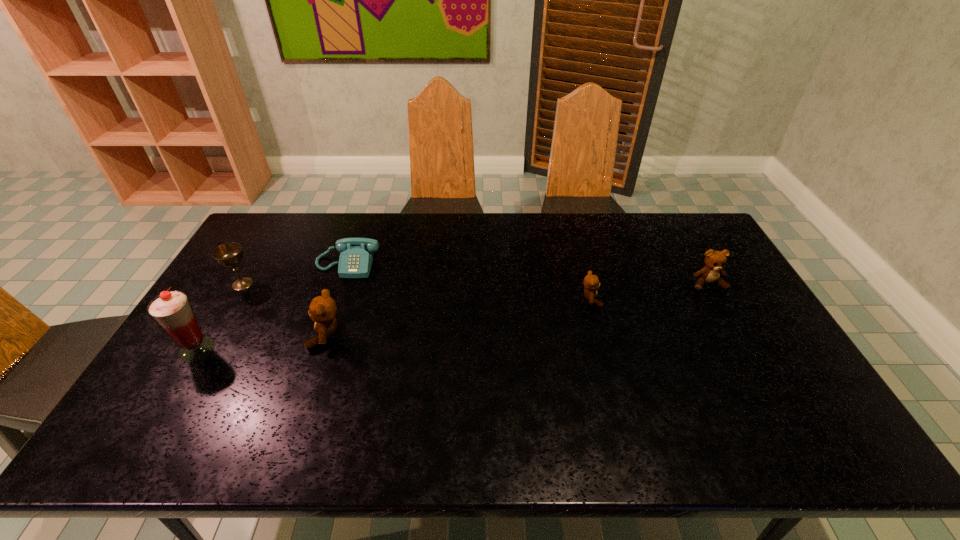
In order to click on object present at the right edge in this screenshot , I will do `click(715, 261)`.

Locate an element on the screen. This screenshot has width=960, height=540. vacant space at the far edge of the desktop is located at coordinates (587, 246).

Locate an element on the screen. This screenshot has width=960, height=540. vacant area at the left edge is located at coordinates (229, 309).

Where is `vacant position at the right edge of the desktop`? vacant position at the right edge of the desktop is located at coordinates (750, 321).

I want to click on free point at the far right corner, so click(x=670, y=244).

Where is `vacant space in between the nearest teddy bear and the tallest object`? vacant space in between the nearest teddy bear and the tallest object is located at coordinates (262, 342).

Find the location of a particular element. empty space that is in between the nearest teddy bear and the second object from right to left is located at coordinates (459, 317).

You are a GUI agent. You are given a task and a screenshot of the screen. Output one action in this format:
    pyautogui.click(x=<x>, y=<y>)
    Task: Click on the vacant space in between the nearest teddy bear and the smoothie
    
    Given the screenshot: What is the action you would take?
    pyautogui.click(x=262, y=342)

You are a GUI agent. You are given a task and a screenshot of the screen. Output one action in this format:
    pyautogui.click(x=<x>, y=<y>)
    Task: Click on the vacant space that is in between the smoothie and the tallest teddy bear
    The image size is (960, 540).
    Given the screenshot: What is the action you would take?
    (262, 342)

The image size is (960, 540). Find the location of `vacant area that lies between the tallest object and the fifth tallest object`. vacant area that lies between the tallest object and the fifth tallest object is located at coordinates (394, 325).